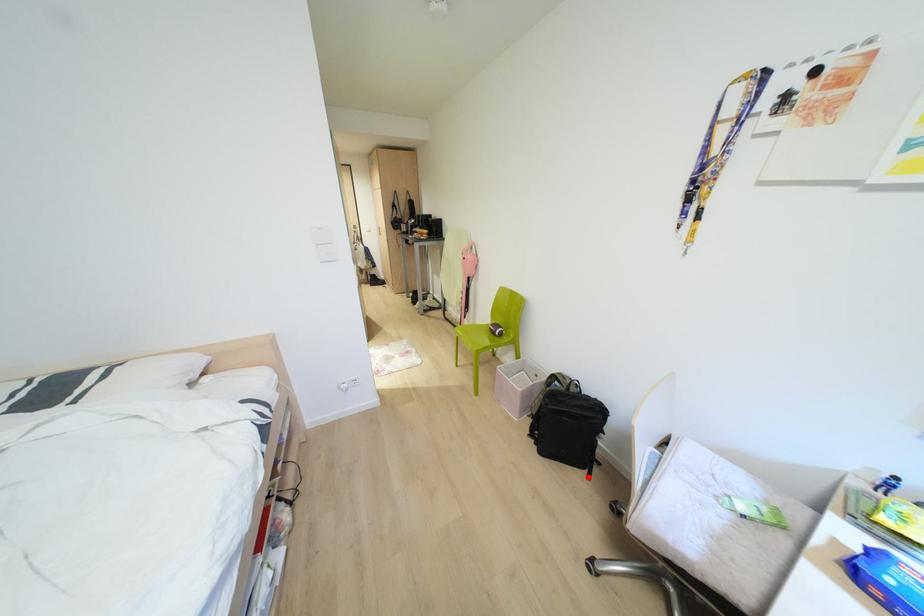
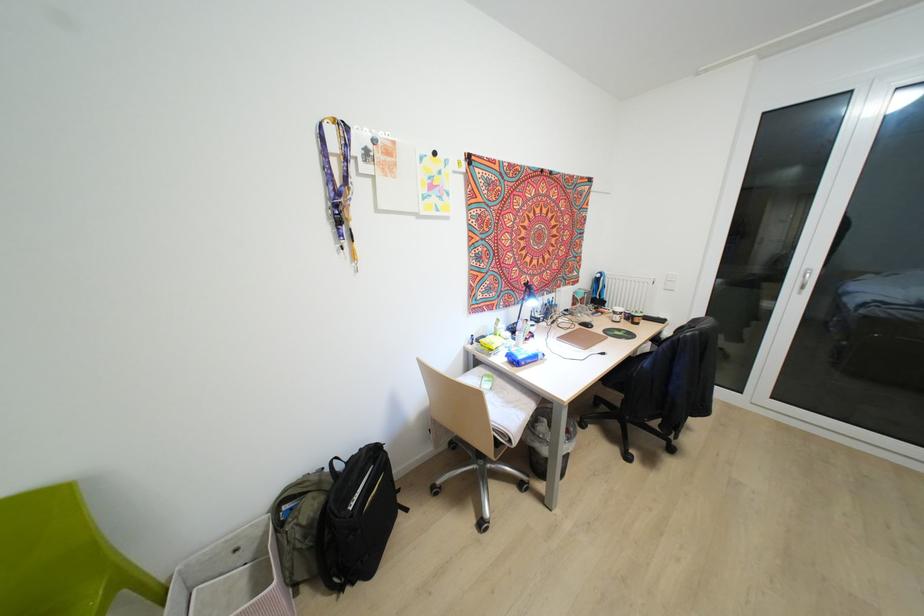
Question: I am providing you with two images of the same scene from different viewpoints. Image1 has a red point marked. In image2, the corresponding 3D location appears at what relative position? Reply with the corresponding letter.

Choices:
 (A) Closer
 (B) Farther

Answer: (B)